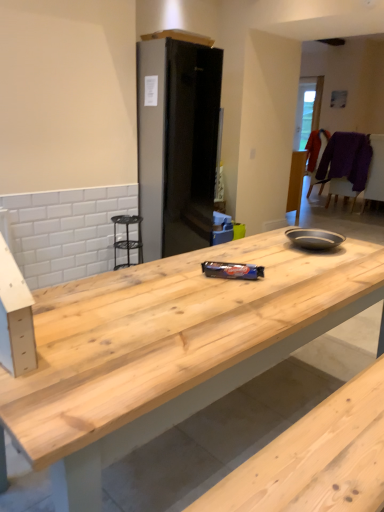
Describe the element at coordinates (316, 156) in the screenshot. Image resolution: width=384 pixels, height=512 pixels. I see `purple fabric chair at upper right, which is the second chair from front to back` at that location.

This screenshot has height=512, width=384. In order to click on purple woolen sweater at right, the 2th chair when ordered from back to front in this screenshot , I will do `click(348, 164)`.

Identify the location of black matte refrigerator at center. (177, 144).

At what (x,y) coordinates should I click in order to perform the action: click on purple fabric chair at upper right, which is the second chair from front to back. Please return your answer as a coordinate pair (x, y). This screenshot has height=512, width=384. Looking at the image, I should click on (316, 156).

Is purple fabric chair at upper right, which is the second chair from front to back, taller than natural wood countertop at center?

In fact, purple fabric chair at upper right, which is the second chair from front to back, may be shorter than natural wood countertop at center.

Consider the image. From a real-world perspective, is purple fabric chair at upper right, which is the second chair from front to back, located higher than natural wood countertop at center?

Yes, from a real-world perspective, purple fabric chair at upper right, which is the second chair from front to back, is on top of natural wood countertop at center.

Which is in front, purple fabric chair at upper right, which is the first chair from back to front, or natural wood countertop at center?

Positioned in front is natural wood countertop at center.

Do you think purple fabric chair at upper right, which is the second chair from front to back, is within natural wood countertop at center, or outside of it?

purple fabric chair at upper right, which is the second chair from front to back, is not inside natural wood countertop at center, it's outside.

Is black matte refrigerator at center looking in the opposite direction of purple fabric chair at upper right, which is the second chair from front to back?

No.

Which of these two, black matte refrigerator at center or purple fabric chair at upper right, which is the first chair from back to front, stands taller?

black matte refrigerator at center.

Based on the photo, which object is thinner, black matte refrigerator at center or purple fabric chair at upper right, which is the second chair from front to back?

With smaller width is purple fabric chair at upper right, which is the second chair from front to back.

Can you confirm if black matte refrigerator at center is smaller than purple fabric chair at upper right, which is the second chair from front to back?

Incorrect, black matte refrigerator at center is not smaller in size than purple fabric chair at upper right, which is the second chair from front to back.

Is natural wood countertop at center looking in the opposite direction of purple woolen sweater at right, which is the 1th chair in front-to-back order?

Yes, purple woolen sweater at right, which is the 1th chair in front-to-back order, is at the back of natural wood countertop at center.

Considering the relative sizes of natural wood countertop at center and purple woolen sweater at right, the 2th chair when ordered from back to front, in the image provided, is natural wood countertop at center wider than purple woolen sweater at right, the 2th chair when ordered from back to front,?

Correct, the width of natural wood countertop at center exceeds that of purple woolen sweater at right, the 2th chair when ordered from back to front.

Which object is positioned more to the left, natural wood countertop at center or purple woolen sweater at right, which is the 1th chair in front-to-back order?

natural wood countertop at center.

Which is in front, purple fabric chair at upper right, which is the first chair from back to front, or black matte refrigerator at center?

black matte refrigerator at center is more forward.

Does purple fabric chair at upper right, which is the first chair from back to front, appear on the right side of black matte refrigerator at center?

Yes, purple fabric chair at upper right, which is the first chair from back to front, is to the right of black matte refrigerator at center.

From the image's perspective, does purple fabric chair at upper right, which is the first chair from back to front, appear lower than black matte refrigerator at center?

No, from the image's perspective, purple fabric chair at upper right, which is the first chair from back to front, is not below black matte refrigerator at center.

Where is `appliance below the purple fabric chair at upper right, which is the second chair from front to back (from the image's perspective)`? appliance below the purple fabric chair at upper right, which is the second chair from front to back (from the image's perspective) is located at coordinates (177, 144).

From the image's perspective, which is below, black matte refrigerator at center or purple woolen sweater at right, the 2th chair when ordered from back to front?

black matte refrigerator at center appears lower in the image.

Does point (197, 193) appear closer or farther from the camera than point (330, 191)?

Point (197, 193) appears to be closer to the viewer than point (330, 191).

Between black matte refrigerator at center and purple woolen sweater at right, which is the 1th chair in front-to-back order, which one is positioned in front?

black matte refrigerator at center is more forward.

Can you confirm if black matte refrigerator at center is positioned to the left of purple woolen sweater at right, which is the 1th chair in front-to-back order?

Indeed, black matte refrigerator at center is positioned on the left side of purple woolen sweater at right, which is the 1th chair in front-to-back order.

From a real-world perspective, which object stands above the other?

In real-world perspective, black matte refrigerator at center is above.

Is natural wood countertop at center outside of black matte refrigerator at center?

Yes, natural wood countertop at center is located beyond the bounds of black matte refrigerator at center.

Which of these two, natural wood countertop at center or black matte refrigerator at center, is bigger?

natural wood countertop at center.

Could you tell me if purple woolen sweater at right, the 2th chair when ordered from back to front, is facing purple fabric chair at upper right, which is the second chair from front to back?

No, purple woolen sweater at right, the 2th chair when ordered from back to front, is not turned towards purple fabric chair at upper right, which is the second chair from front to back.

From their relative heights in the image, would you say purple woolen sweater at right, the 2th chair when ordered from back to front, is taller or shorter than purple fabric chair at upper right, which is the second chair from front to back?

purple woolen sweater at right, the 2th chair when ordered from back to front, is taller than purple fabric chair at upper right, which is the second chair from front to back.

Can you confirm if purple woolen sweater at right, the 2th chair when ordered from back to front, is bigger than purple fabric chair at upper right, which is the second chair from front to back?

Yes.

In order to click on countertop below the purple fabric chair at upper right, which is the second chair from front to back (from the image's perspective) in this screenshot , I will do `click(167, 349)`.

Image resolution: width=384 pixels, height=512 pixels. Find the location of `appliance in front of the purple fabric chair at upper right, which is the second chair from front to back`. appliance in front of the purple fabric chair at upper right, which is the second chair from front to back is located at coordinates (177, 144).

From the image, which object appears to be nearer to purple woolen sweater at right, which is the 1th chair in front-to-back order, purple fabric chair at upper right, which is the second chair from front to back, or black matte refrigerator at center?

The object closer to purple woolen sweater at right, which is the 1th chair in front-to-back order, is purple fabric chair at upper right, which is the second chair from front to back.

Considering their positions, is purple fabric chair at upper right, which is the first chair from back to front, positioned closer to natural wood countertop at center than purple woolen sweater at right, the 2th chair when ordered from back to front?

purple woolen sweater at right, the 2th chair when ordered from back to front.

Looking at the image, which one is located further to purple fabric chair at upper right, which is the second chair from front to back, black matte refrigerator at center or natural wood countertop at center?

natural wood countertop at center is positioned further to the anchor purple fabric chair at upper right, which is the second chair from front to back.

Considering their positions, is purple woolen sweater at right, the 2th chair when ordered from back to front, positioned closer to black matte refrigerator at center than natural wood countertop at center?

Based on the image, purple woolen sweater at right, the 2th chair when ordered from back to front, appears to be nearer to black matte refrigerator at center.

When comparing their distances from black matte refrigerator at center, does purple fabric chair at upper right, which is the first chair from back to front, or purple woolen sweater at right, the 2th chair when ordered from back to front, seem further?

purple fabric chair at upper right, which is the first chair from back to front, is positioned further to the anchor black matte refrigerator at center.

Based on the photo, based on their spatial positions, is black matte refrigerator at center or purple fabric chair at upper right, which is the second chair from front to back, closer to purple woolen sweater at right, which is the 1th chair in front-to-back order?

The object closer to purple woolen sweater at right, which is the 1th chair in front-to-back order, is purple fabric chair at upper right, which is the second chair from front to back.

Estimate the real-world distances between objects in this image. Which object is closer to black matte refrigerator at center, purple fabric chair at upper right, which is the second chair from front to back, or natural wood countertop at center?

Among the two, purple fabric chair at upper right, which is the second chair from front to back, is located nearer to black matte refrigerator at center.

Based on their spatial positions, is black matte refrigerator at center or natural wood countertop at center closer to purple woolen sweater at right, which is the 1th chair in front-to-back order?

Based on the image, black matte refrigerator at center appears to be nearer to purple woolen sweater at right, which is the 1th chair in front-to-back order.

Identify the location of appliance between natural wood countertop at center and purple woolen sweater at right, which is the 1th chair in front-to-back order, in the front-back direction. This screenshot has width=384, height=512. (177, 144).

This screenshot has height=512, width=384. I want to click on chair between black matte refrigerator at center and purple fabric chair at upper right, which is the second chair from front to back, along the z-axis, so click(348, 164).

Image resolution: width=384 pixels, height=512 pixels. I want to click on chair between natural wood countertop at center and purple fabric chair at upper right, which is the second chair from front to back, from front to back, so click(x=348, y=164).

Where is `appliance between natural wood countertop at center and purple fabric chair at upper right, which is the first chair from back to front, from front to back`? appliance between natural wood countertop at center and purple fabric chair at upper right, which is the first chair from back to front, from front to back is located at coordinates (177, 144).